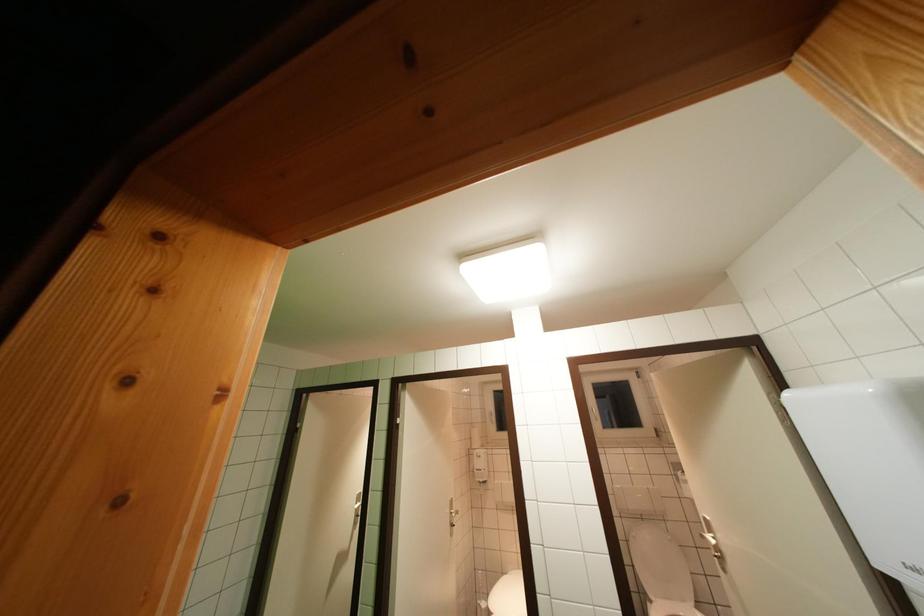
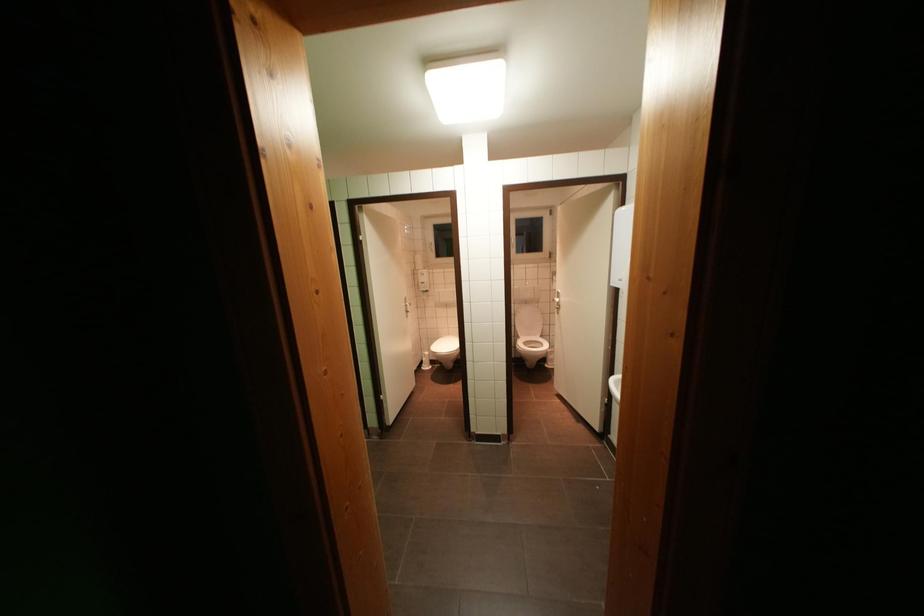
The images are taken continuously from a first-person perspective. In which direction is your viewpoint rotating?

The rotation direction of the camera is right-down.